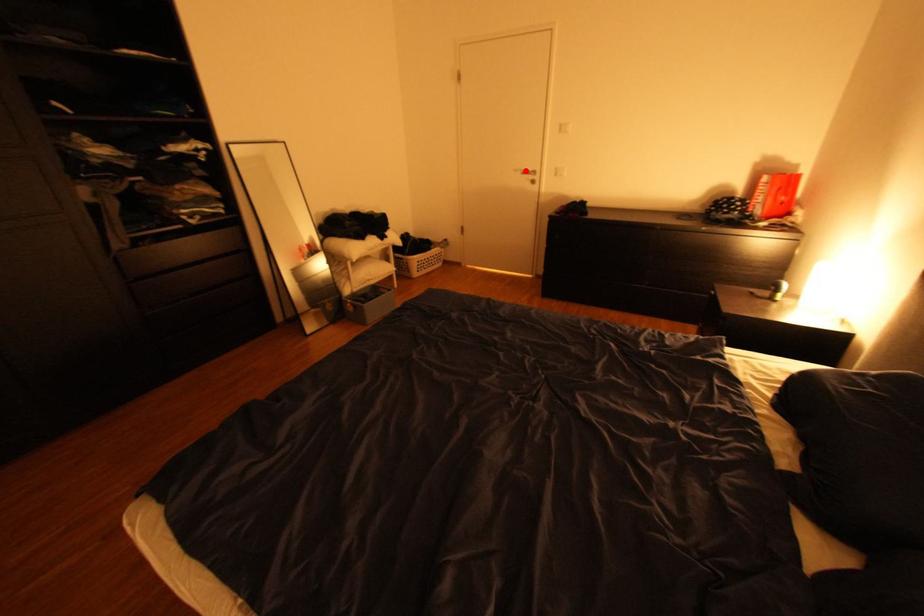
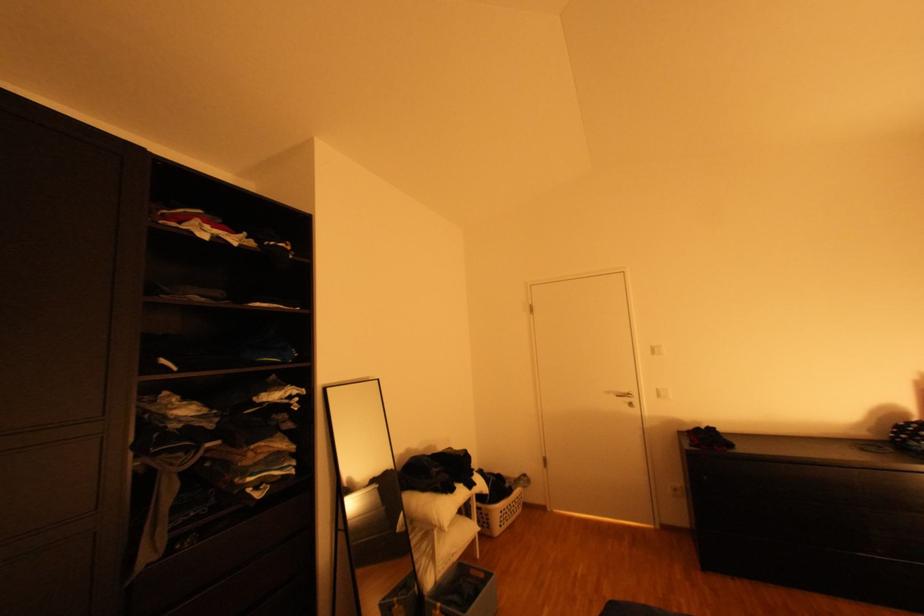
The point at the highlighted location is marked in the first image. Where is the corresponding point in the second image?

(617, 392)